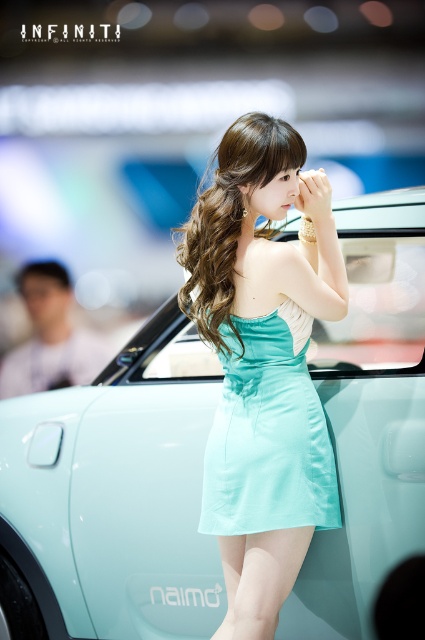
Does teal satin dress at center appear over mint satin dress at center?

Correct, teal satin dress at center is located above mint satin dress at center.

Does teal satin dress at center have a larger size compared to mint satin dress at center?

Correct, teal satin dress at center is larger in size than mint satin dress at center.

Is point (240, 138) farther from viewer compared to point (328, 480)?

No, (240, 138) is closer to viewer.

Find the location of `teal satin dress at center`. teal satin dress at center is located at coordinates (263, 364).

Does point (413, 381) lie behind point (300, 406)?

Yes, point (413, 381) is behind point (300, 406).

Who is shorter, light blue satin car at center or mint satin dress at center?

mint satin dress at center

What do you see at coordinates (115, 496) in the screenshot? The image size is (425, 640). I see `light blue satin car at center` at bounding box center [115, 496].

This screenshot has width=425, height=640. I want to click on light blue satin car at center, so click(x=115, y=496).

Is light blue satin car at center to the right of teal satin dress at center from the viewer's perspective?

Incorrect, light blue satin car at center is not on the right side of teal satin dress at center.

How far apart are light blue satin car at center and teal satin dress at center?

light blue satin car at center and teal satin dress at center are 35.75 centimeters apart.

This screenshot has width=425, height=640. What do you see at coordinates (115, 496) in the screenshot?
I see `light blue satin car at center` at bounding box center [115, 496].

This screenshot has width=425, height=640. I want to click on light blue satin car at center, so click(115, 496).